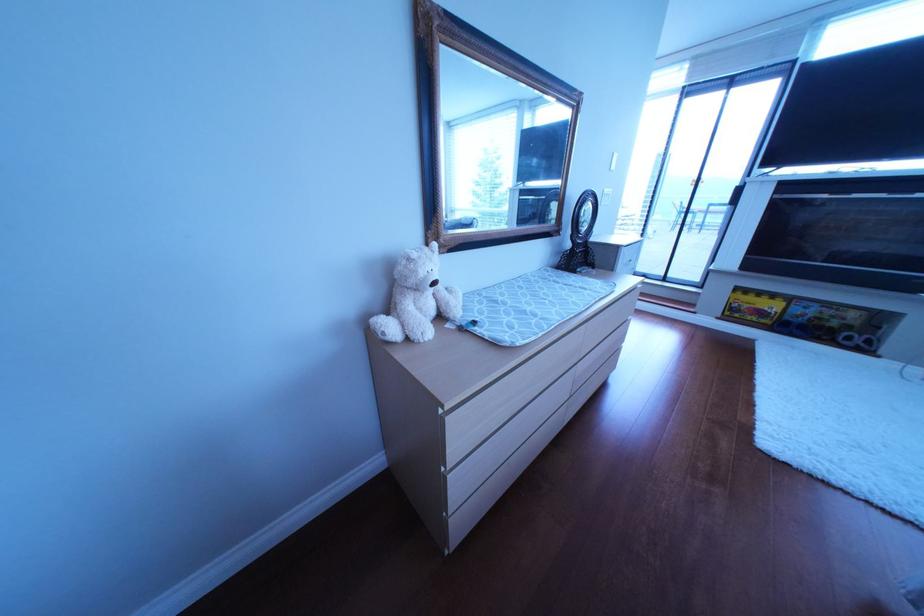
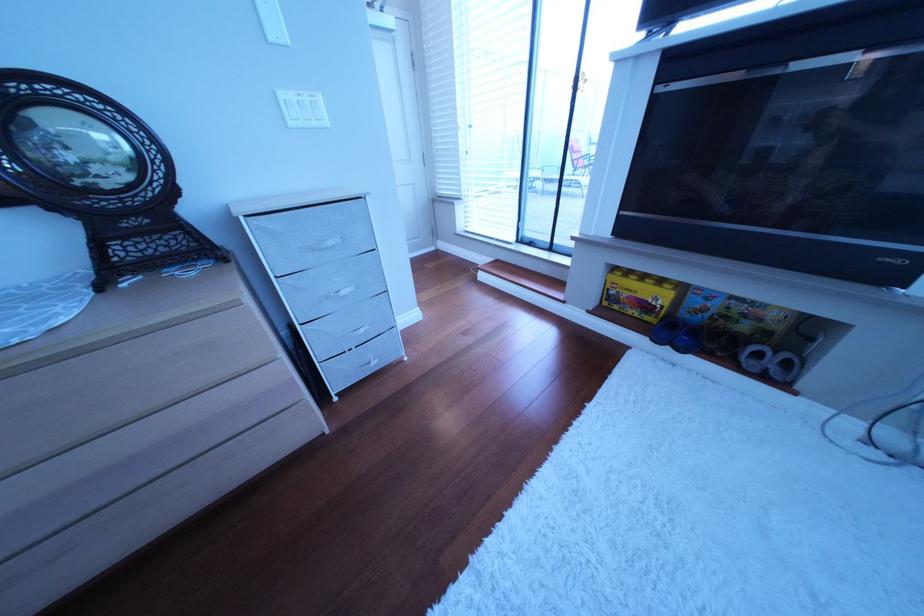
Locate, in the second image, the point that corresponds to (761,308) in the first image.

(640, 296)